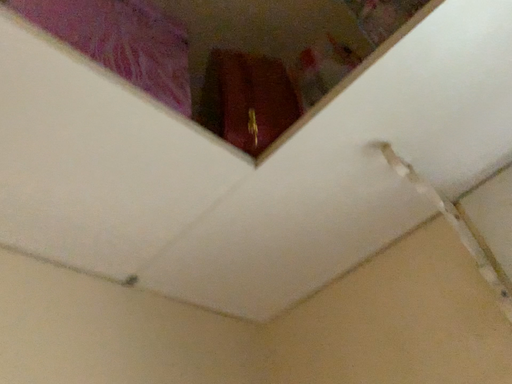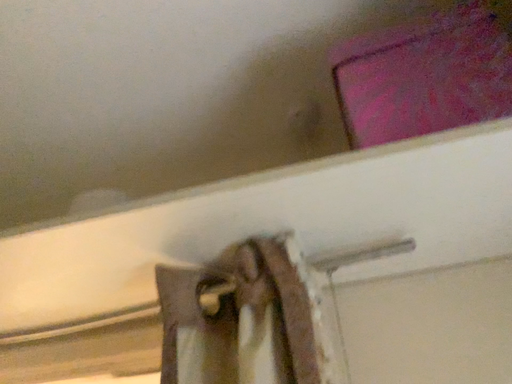
Question: Which way did the camera rotate in the video?

Choices:
 (A) rotated downward
 (B) rotated upward

Answer: (A)